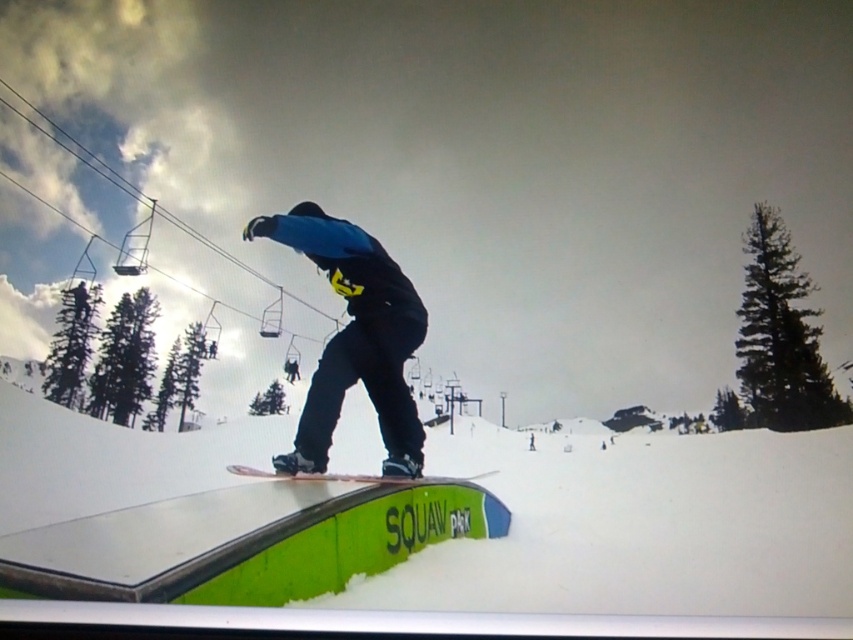
You are a photographer at Squaw Valley and want to capture a photo of the matte black snowboarder at center and the white matte snow at center. Based on their positions, which object is located to the right side of the other?

The white matte snow at center is positioned on the right side of the matte black snowboarder at center, so the white matte snow at center is to the right of the matte black snowboarder at center.

You are standing at the point marked as point (x=579, y=552) in the image of Squaw Valley. You want to take a photo of the snowboarder performing a trick on the green rail labeled SQUAW PARK. Will you be able to see the snowboarder clearly from your current position?

The point (x=579, y=552) is 6.12 meters away from the viewer. Since the snowboarder is midair performing a trick on the green rail labeled SQUAW PARK, which is part of the scene, the viewer should be able to see the snowboarder clearly from that distance unless there are obstructions not mentioned in the scene description.